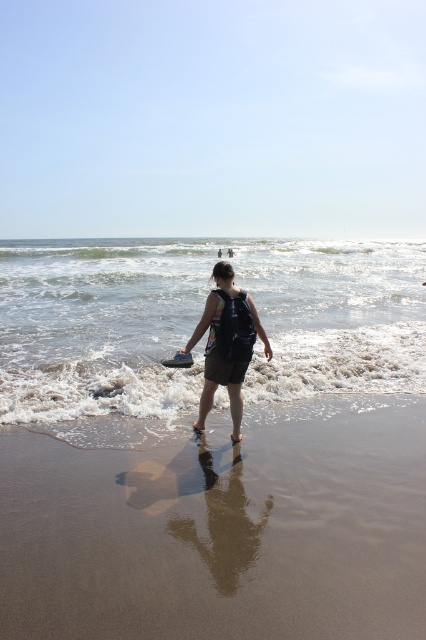
You are standing on the brown sandy beach at lower center and want to reach the foamy white water at lower center. Which direction should you move to get there?

Since the brown sandy beach at lower center is below the foamy white water at lower center, you should move upward to reach the foamy white water at lower center from the brown sandy beach at lower center.

Consider the image. You are a photographer trying to capture the person walking on the beach. You want to ensure that both the foamy white water at lower center and the matte black backpack at center are clearly visible in your shot. Based on their sizes, which object might require you to adjust your camera angle to include it properly?

The foamy white water at lower center might be wider than the matte black backpack at center, so you might need to adjust your camera angle to ensure the wider foamy white water at lower center is fully captured in the frame.